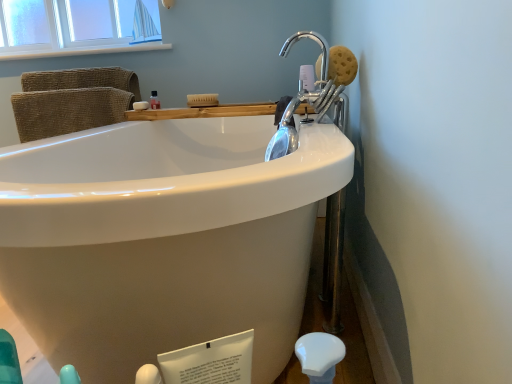
Question: Does wooden tray at upper center have a greater height compared to translucent plastic bottle at upper center?

Choices:
 (A) yes
 (B) no

Answer: (B)

Question: Is wooden tray at upper center shorter than translucent plastic bottle at upper center?

Choices:
 (A) yes
 (B) no

Answer: (A)

Question: Can you confirm if wooden tray at upper center is positioned to the left of translucent plastic bottle at upper center?

Choices:
 (A) yes
 (B) no

Answer: (B)

Question: Is wooden tray at upper center next to translucent plastic bottle at upper center?

Choices:
 (A) no
 (B) yes

Answer: (A)

Question: Does wooden tray at upper center appear on the right side of translucent plastic bottle at upper center?

Choices:
 (A) yes
 (B) no

Answer: (A)

Question: From the image's perspective, is translucent plastic bottle at upper center above or below white wood window sill at upper left?

Choices:
 (A) below
 (B) above

Answer: (A)

Question: From a real-world perspective, relative to white wood window sill at upper left, is translucent plastic bottle at upper center vertically above or below?

Choices:
 (A) above
 (B) below

Answer: (B)

Question: Considering the positions of point (156, 92) and point (95, 49), is point (156, 92) closer or farther from the camera than point (95, 49)?

Choices:
 (A) farther
 (B) closer

Answer: (B)

Question: Would you say translucent plastic bottle at upper center is to the left or to the right of white wood window sill at upper left in the picture?

Choices:
 (A) right
 (B) left

Answer: (A)

Question: From a real-world perspective, relative to wooden tray at upper center, is brown sponge at upper right, positioned as the second soap in back-to-front order, vertically above or below?

Choices:
 (A) below
 (B) above

Answer: (B)

Question: Choose the correct answer: Is brown sponge at upper right, positioned as the 1th soap in front-to-back order, inside wooden tray at upper center or outside it?

Choices:
 (A) inside
 (B) outside

Answer: (B)

Question: Considering the positions of point tap(330, 49) and point tap(197, 112), is point tap(330, 49) closer or farther from the camera than point tap(197, 112)?

Choices:
 (A) closer
 (B) farther

Answer: (A)

Question: Considering the positions of brown sponge at upper right, the 1th soap viewed from the right, and wooden tray at upper center in the image, is brown sponge at upper right, the 1th soap viewed from the right, taller or shorter than wooden tray at upper center?

Choices:
 (A) short
 (B) tall

Answer: (B)

Question: Does point (242, 112) appear closer or farther from the camera than point (154, 94)?

Choices:
 (A) closer
 (B) farther

Answer: (A)

Question: From the image's perspective, is wooden tray at upper center above or below translucent plastic bottle at upper center?

Choices:
 (A) above
 (B) below

Answer: (B)